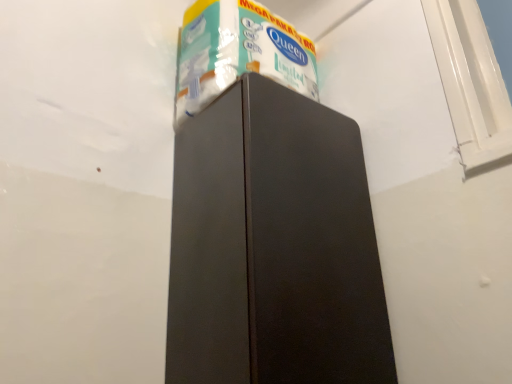
Question: Based on their sizes in the image, would you say white glossy toilet paper at upper center is bigger or smaller than matte black refrigerator at center?

Choices:
 (A) small
 (B) big

Answer: (A)

Question: From the image's perspective, is white glossy toilet paper at upper center positioned above or below matte black refrigerator at center?

Choices:
 (A) below
 (B) above

Answer: (B)

Question: From a real-world perspective, relative to matte black refrigerator at center, is white glossy toilet paper at upper center vertically above or below?

Choices:
 (A) below
 (B) above

Answer: (B)

Question: In terms of size, does matte black refrigerator at center appear bigger or smaller than white glossy toilet paper at upper center?

Choices:
 (A) big
 (B) small

Answer: (A)

Question: Relative to white glossy toilet paper at upper center, is matte black refrigerator at center in front or behind?

Choices:
 (A) behind
 (B) front

Answer: (B)

Question: Is matte black refrigerator at center to the left or to the right of white glossy toilet paper at upper center in the image?

Choices:
 (A) left
 (B) right

Answer: (B)

Question: Would you say matte black refrigerator at center is inside or outside white glossy toilet paper at upper center?

Choices:
 (A) outside
 (B) inside

Answer: (A)